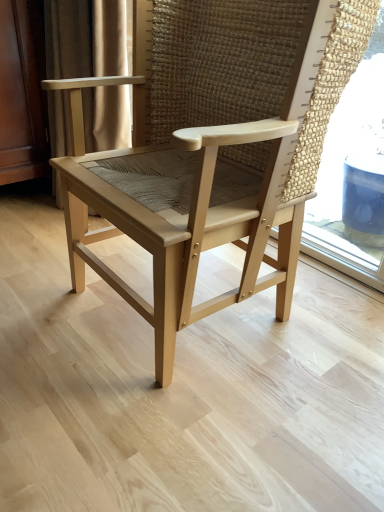
Question: Considering the positions of natural wood chair at center and satin gold curtain at left in the image, is natural wood chair at center taller or shorter than satin gold curtain at left?

Choices:
 (A) short
 (B) tall

Answer: (A)

Question: Looking at the image, does natural wood chair at center seem bigger or smaller compared to satin gold curtain at left?

Choices:
 (A) big
 (B) small

Answer: (A)

Question: From the image's perspective, is natural wood chair at center above or below satin gold curtain at left?

Choices:
 (A) below
 (B) above

Answer: (A)

Question: From the image's perspective, is satin gold curtain at left located above or below natural wood chair at center?

Choices:
 (A) below
 (B) above

Answer: (B)

Question: In the image, is satin gold curtain at left positioned in front of or behind natural wood chair at center?

Choices:
 (A) front
 (B) behind

Answer: (B)

Question: Considering the positions of satin gold curtain at left and natural wood chair at center in the image, is satin gold curtain at left wider or thinner than natural wood chair at center?

Choices:
 (A) wide
 (B) thin

Answer: (B)

Question: Would you say satin gold curtain at left is inside or outside natural wood chair at center?

Choices:
 (A) inside
 (B) outside

Answer: (B)